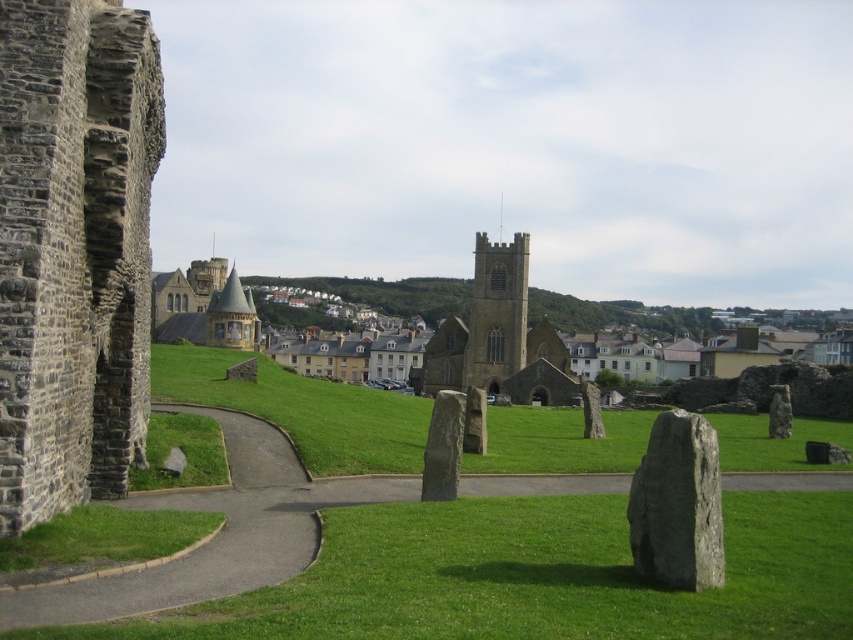
Question: Among these objects, which one is nearest to the camera?

Choices:
 (A) dark brown stone tower at center
 (B) gray stone church at left

Answer: (B)

Question: Does gray stone church at left appear on the left side of dark brown stone tower at center?

Choices:
 (A) no
 (B) yes

Answer: (B)

Question: Which object is the farthest from the gray polished stone at center?

Choices:
 (A) gray rough stone at center
 (B) smooth gray stone at center
 (C) dark brown stone tower at center

Answer: (C)

Question: Is gray rough stone at center positioned at the back of dark brown stone tower at center?

Choices:
 (A) yes
 (B) no

Answer: (B)

Question: Is gray stone church at left smaller than gray rough stone at center?

Choices:
 (A) yes
 (B) no

Answer: (B)

Question: Which object is farther from the camera taking this photo?

Choices:
 (A) gray stone church at left
 (B) dark brown stone tower at center

Answer: (B)